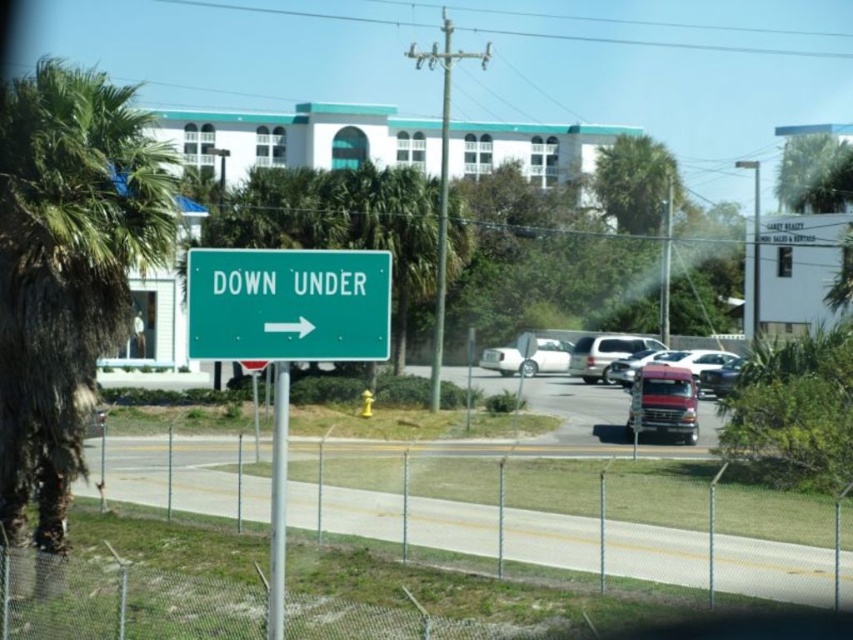
You are standing in front of the green road sign with white text reading DOWN UNDER and a right arrow. You notice a point at coordinates (813, 170). What object does this point correspond to in the scene?

The point at coordinates (813, 170) corresponds to the green leafy palm tree at upper right.

You are a delivery driver who needs to park your vehicle. You see the green plastic sign at center and the green leafy palm tree at upper right in the scene. Which object is narrower, and can you park between them if your vehicle is 2 meters wide?

The green plastic sign at center is thinner than the green leafy palm tree at upper right. Since the sign is thinner, but the exact width isn not provided, we cannot determine if the space between them is sufficient for a 2 meter wide vehicle. Please check the actual distance.

You are a delivery driver passing by the green plastic sign at center and the green leafy palm tree at upper right. Which object takes up more visual space in the image?

The green leafy palm tree at upper right takes up more visual space than the green plastic sign at center.